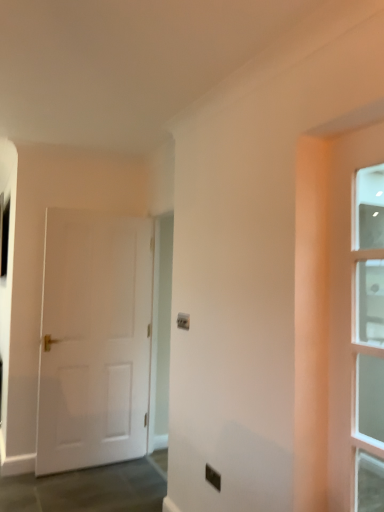
Question: Are black plastic electric outlet at center and white matte door at left, positioned as the 1th door in back-to-front order, far apart?

Choices:
 (A) no
 (B) yes

Answer: (B)

Question: Is black plastic electric outlet at center closer to camera compared to white matte door at left, the second door in the right-to-left sequence?

Choices:
 (A) yes
 (B) no

Answer: (A)

Question: Considering the relative positions of black plastic electric outlet at center and white matte door at left, the first door when ordered from left to right, in the image provided, is black plastic electric outlet at center to the left of white matte door at left, the first door when ordered from left to right, from the viewer's perspective?

Choices:
 (A) yes
 (B) no

Answer: (B)

Question: Is black plastic electric outlet at center outside of white matte door at left, acting as the second door starting from the front?

Choices:
 (A) no
 (B) yes

Answer: (B)

Question: From the image's perspective, would you say black plastic electric outlet at center is positioned over white matte door at left, the second door in the right-to-left sequence?

Choices:
 (A) no
 (B) yes

Answer: (A)

Question: From a real-world perspective, is black plastic electric outlet at center located higher than white matte door at left, positioned as the 1th door in back-to-front order?

Choices:
 (A) yes
 (B) no

Answer: (B)

Question: Can you confirm if white matte door at left, the second door in the right-to-left sequence, is taller than clear glass door at right, the 2th door viewed from the left?

Choices:
 (A) no
 (B) yes

Answer: (B)

Question: From a real-world perspective, is white matte door at left, positioned as the 1th door in back-to-front order, located higher than clear glass door at right, the 1th door in the right-to-left sequence?

Choices:
 (A) yes
 (B) no

Answer: (B)

Question: Can you confirm if white matte door at left, the first door when ordered from left to right, is shorter than clear glass door at right, the 2th door viewed from the left?

Choices:
 (A) yes
 (B) no

Answer: (B)

Question: Could you tell me if white matte door at left, the first door when ordered from left to right, is facing clear glass door at right, the 2th door from the back?

Choices:
 (A) yes
 (B) no

Answer: (A)

Question: Is white matte door at left, the first door when ordered from left to right, bigger than clear glass door at right, the 2th door from the back?

Choices:
 (A) yes
 (B) no

Answer: (A)

Question: Is white matte door at left, positioned as the 1th door in back-to-front order, not inside clear glass door at right, the 2th door viewed from the left?

Choices:
 (A) no
 (B) yes

Answer: (B)

Question: Is clear glass door at right, arranged as the first door when viewed from the front, located within black plastic electric outlet at center?

Choices:
 (A) no
 (B) yes

Answer: (A)